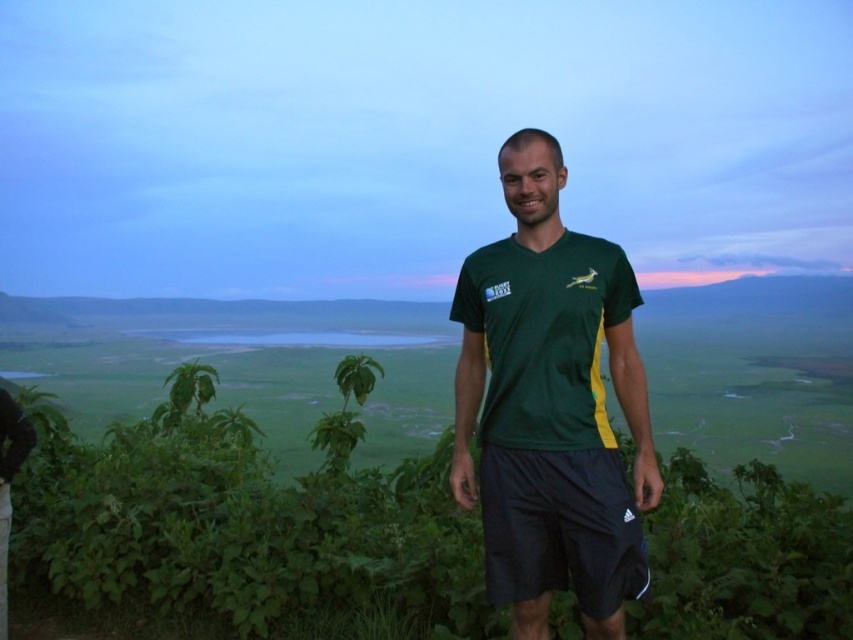
Question: Which object appears closest to the camera in this image?

Choices:
 (A) green leafy shrubs at center
 (B) green matte shirt at center

Answer: (B)

Question: Does green leafy shrubs at center appear on the right side of green matte shirt at center?

Choices:
 (A) no
 (B) yes

Answer: (A)

Question: Can you confirm if green leafy shrubs at center is positioned below green matte shirt at center?

Choices:
 (A) yes
 (B) no

Answer: (A)

Question: Which of the following is the closest to the observer?

Choices:
 (A) green leafy shrubs at center
 (B) green matte shirt at center

Answer: (B)

Question: Is green leafy shrubs at center above green matte shirt at center?

Choices:
 (A) no
 (B) yes

Answer: (A)